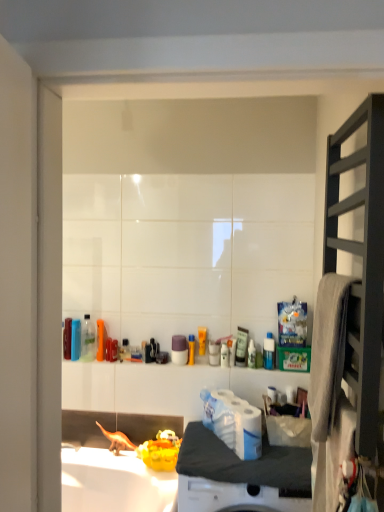
Question: From the image's perspective, is dark wood shelf at right below white matte counter top at center?

Choices:
 (A) no
 (B) yes

Answer: (A)

Question: Can you confirm if dark wood shelf at right is wider than white matte counter top at center?

Choices:
 (A) no
 (B) yes

Answer: (A)

Question: Does dark wood shelf at right come in front of white matte counter top at center?

Choices:
 (A) no
 (B) yes

Answer: (B)

Question: Is dark wood shelf at right not near white matte counter top at center?

Choices:
 (A) no
 (B) yes

Answer: (A)

Question: From a real-world perspective, does dark wood shelf at right sit lower than white matte counter top at center?

Choices:
 (A) no
 (B) yes

Answer: (A)

Question: Can you confirm if dark wood shelf at right is thinner than white matte counter top at center?

Choices:
 (A) no
 (B) yes

Answer: (B)

Question: Does white glossy toilet paper at center lie in front of dark wood shelf at right?

Choices:
 (A) no
 (B) yes

Answer: (A)

Question: From the image's perspective, would you say white glossy toilet paper at center is shown under dark wood shelf at right?

Choices:
 (A) no
 (B) yes

Answer: (B)

Question: Would you consider white glossy toilet paper at center to be distant from dark wood shelf at right?

Choices:
 (A) no
 (B) yes

Answer: (A)

Question: Does white glossy toilet paper at center contain dark wood shelf at right?

Choices:
 (A) no
 (B) yes

Answer: (A)

Question: From a real-world perspective, is white glossy toilet paper at center beneath dark wood shelf at right?

Choices:
 (A) no
 (B) yes

Answer: (B)

Question: Is white glossy toilet paper at center next to dark wood shelf at right?

Choices:
 (A) yes
 (B) no

Answer: (B)

Question: From a real-world perspective, is white glossy toilet paper at center below white matte counter top at center?

Choices:
 (A) no
 (B) yes

Answer: (A)